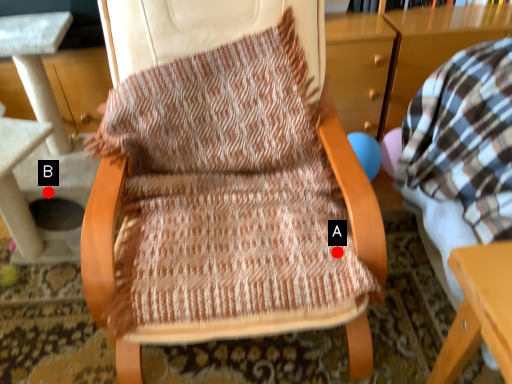
Question: Two points are circled on the image, labeled by A and B beside each circle. Which point appears closest to the camera in this image?

Choices:
 (A) A is closer
 (B) B is closer

Answer: (A)